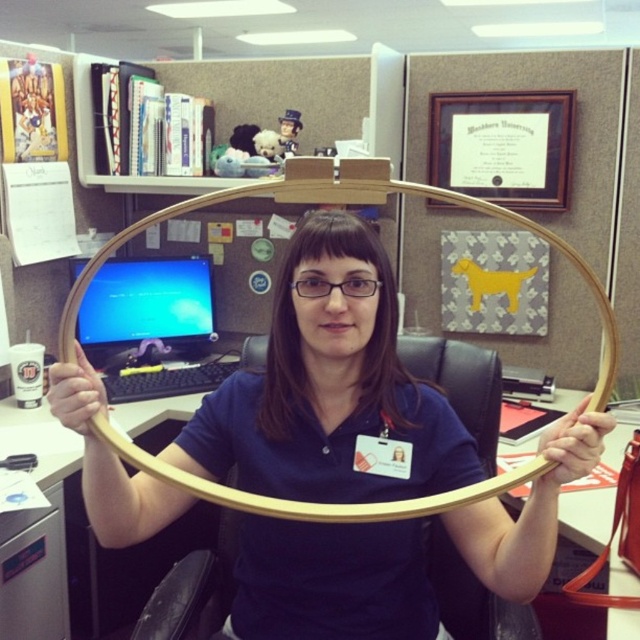
You are an office worker who needs to place a new poster exactly at the same 2D coordinates as the matte gold hoop at center. According to the image, what are the coordinates where you should place the poster?

The 2D coordinates for the matte gold hoop at center are at point (326, 385). Therefore, you should place the poster at those exact coordinates.

You are an office worker who needs to place a new 1.2 meters long poster between the matte gold hoop at center and the blue glossy monitor at center. Can you fit the poster between them without overlapping either object?

The distance between the matte gold hoop at center and the blue glossy monitor at center is 1.19 meters, which is slightly shorter than the 1.2 meters long poster. Therefore, the poster cannot be placed between them without overlapping either object.